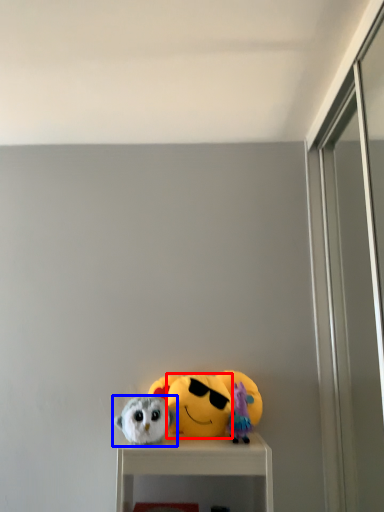
Question: Which of the following is the closest to the observer, face (highlighted by a red box) or toy (highlighted by a blue box)?

Choices:
 (A) face
 (B) toy

Answer: (B)